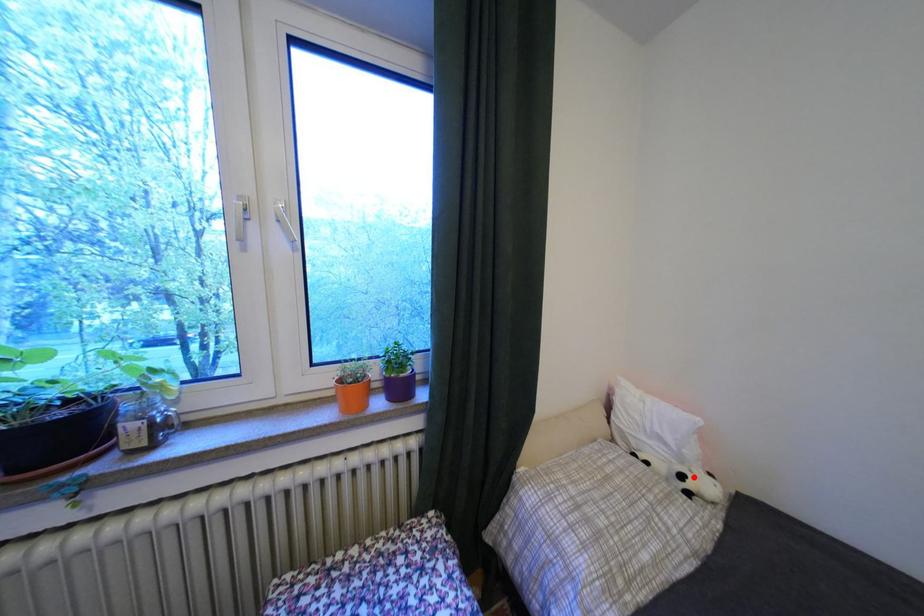
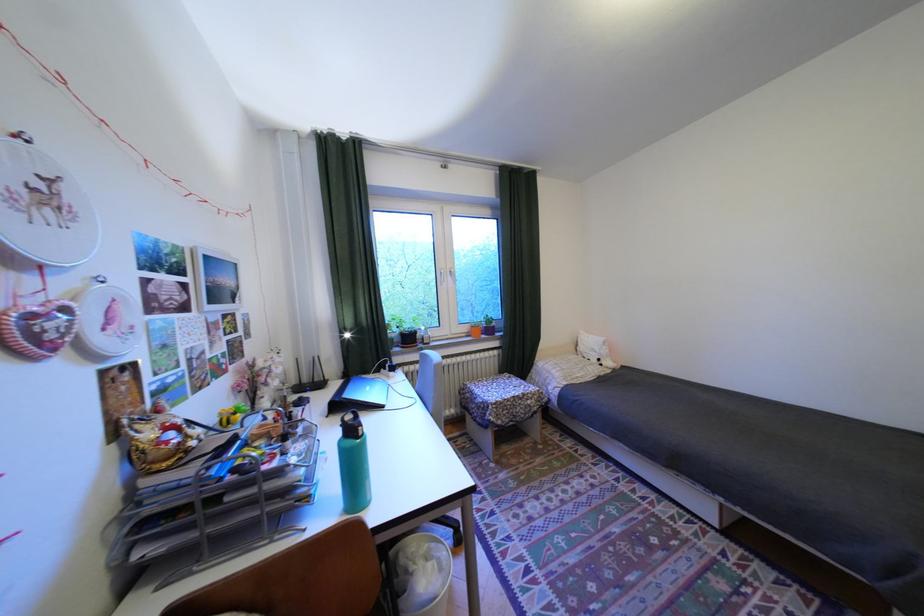
Question: I am providing you with two images of the same scene from different viewpoints. Image1 has a red point marked. In image2, the corresponding 3D location appears at what relative position? Reply with the corresponding letter.

Choices:
 (A) Closer
 (B) Farther

Answer: (B)